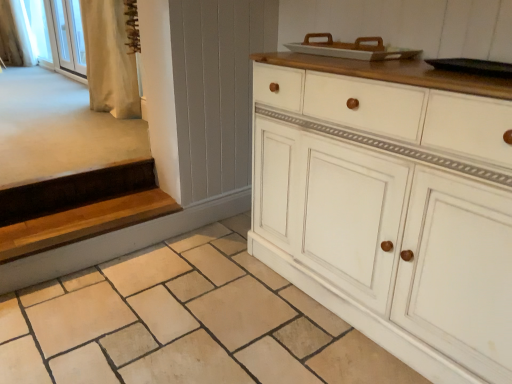
Question: Considering the relative positions of white fabric curtain at upper left, positioned as the 1th curtain in left-to-right order, and white painted wood cabinet at center in the image provided, is white fabric curtain at upper left, positioned as the 1th curtain in left-to-right order, to the left or to the right of white painted wood cabinet at center?

Choices:
 (A) right
 (B) left

Answer: (B)

Question: Is white fabric curtain at upper left, which ranks as the second curtain in right-to-left order, inside the boundaries of white painted wood cabinet at center, or outside?

Choices:
 (A) inside
 (B) outside

Answer: (B)

Question: Estimate the real-world distances between objects in this image. Which object is farther from the white painted wood cabinet at center?

Choices:
 (A) natural stone tile at lower center
 (B) white fabric curtain at upper left, which is counted as the 1th curtain, starting from the top
 (C) wooden at left
 (D) white glass screen door at upper left
 (E) white fabric at upper left

Answer: (B)

Question: Which is nearer to the white fabric at upper left?

Choices:
 (A) white fabric curtain at upper left, the 1th curtain in the back-to-front sequence
 (B) white painted wood cabinet at center
 (C) wooden at left
 (D) white glass screen door at upper left
 (E) natural stone tile at lower center

Answer: (A)